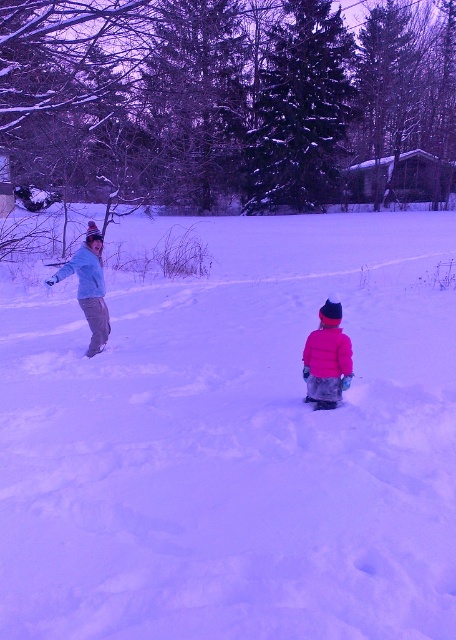
Question: Does white fluffy snow at center have a greater width compared to matte blue jacket at left?

Choices:
 (A) yes
 (B) no

Answer: (A)

Question: Which point is farther to the camera?

Choices:
 (A) (222, 444)
 (B) (87, 266)

Answer: (B)

Question: Which object is farther from the camera taking this photo?

Choices:
 (A) white fluffy snow at center
 (B) pink fleece jacket at center
 (C) matte blue jacket at left

Answer: (C)

Question: Can you confirm if white fluffy snow at center is thinner than matte blue jacket at left?

Choices:
 (A) no
 (B) yes

Answer: (A)

Question: Can you confirm if white fluffy snow at center is positioned to the right of matte blue jacket at left?

Choices:
 (A) yes
 (B) no

Answer: (A)

Question: Which object appears farthest from the camera in this image?

Choices:
 (A) pink fleece jacket at center
 (B) white fluffy snow at center
 (C) matte blue jacket at left

Answer: (C)